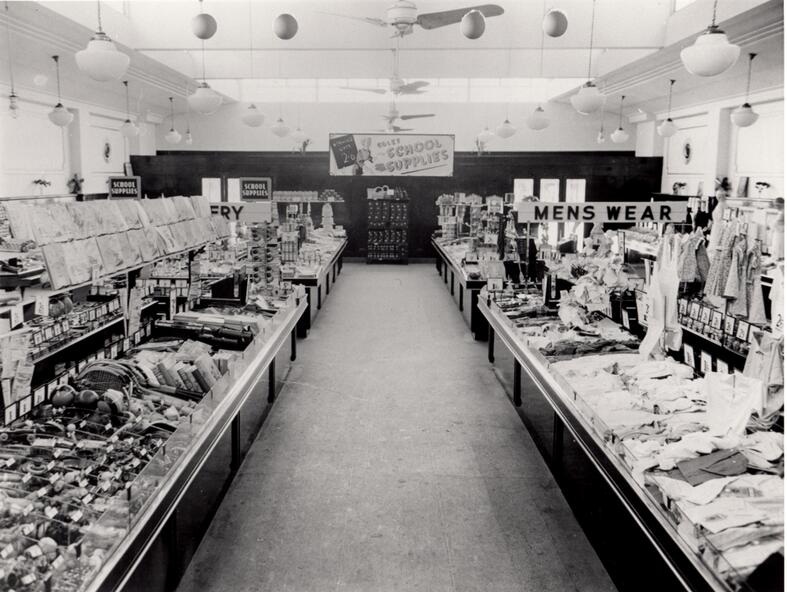
Identify the location of ceiling fan. (397, 12), (394, 83), (390, 114), (392, 128).